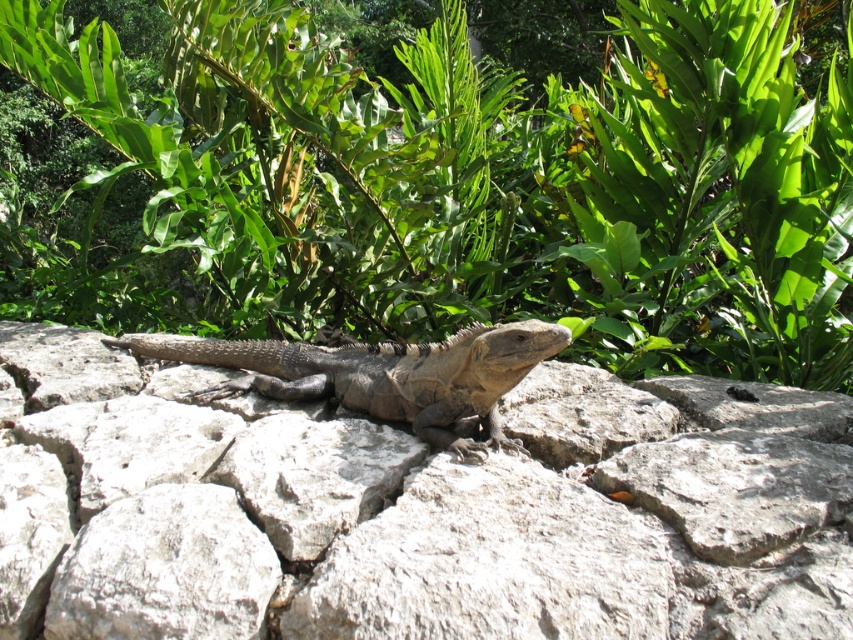
Between point (360, 108) and point (207, 342), which one is positioned behind?

The point (360, 108) is behind.

Does green leafy plant at center appear under leathery brown lizard at center?

Incorrect, green leafy plant at center is not positioned below leathery brown lizard at center.

Which is behind, point (392, 339) or point (497, 444)?

The point (392, 339) is more distant.

Where is `green leafy plant at center`? The image size is (853, 640). green leafy plant at center is located at coordinates (457, 186).

Which is below, green leafy plant at center or gray rough stone at center?

Positioned lower is gray rough stone at center.

Where is `green leafy plant at center`? Image resolution: width=853 pixels, height=640 pixels. green leafy plant at center is located at coordinates (457, 186).

What do you see at coordinates (457, 186) in the screenshot?
I see `green leafy plant at center` at bounding box center [457, 186].

This screenshot has height=640, width=853. In order to click on green leafy plant at center in this screenshot , I will do `click(457, 186)`.

Between gray rough stone at center and leathery brown lizard at center, which one is positioned higher?

leathery brown lizard at center is higher up.

Which is behind, point (55, 355) or point (230, 385)?

Positioned behind is point (55, 355).

This screenshot has height=640, width=853. In order to click on gray rough stone at center in this screenshot , I will do `click(413, 508)`.